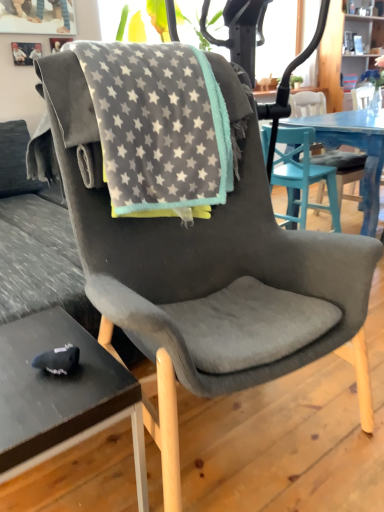
Question: From the image's perspective, is gray fleece blanket at center under suede gray chair at center?

Choices:
 (A) yes
 (B) no

Answer: (B)

Question: Does gray fleece blanket at center contain suede gray chair at center?

Choices:
 (A) yes
 (B) no

Answer: (B)

Question: Is gray fleece blanket at center positioned in front of suede gray chair at center?

Choices:
 (A) no
 (B) yes

Answer: (B)

Question: Can you confirm if gray fleece blanket at center is taller than suede gray chair at center?

Choices:
 (A) yes
 (B) no

Answer: (B)

Question: Can you confirm if gray fleece blanket at center is wider than suede gray chair at center?

Choices:
 (A) no
 (B) yes

Answer: (B)

Question: Looking at their shapes, would you say gray fleece blanket at center is wider or thinner than suede gray chair at center?

Choices:
 (A) thin
 (B) wide

Answer: (B)

Question: From the image's perspective, is gray fleece blanket at center located above or below suede gray chair at center?

Choices:
 (A) below
 (B) above

Answer: (B)

Question: Based on their sizes in the image, would you say gray fleece blanket at center is bigger or smaller than suede gray chair at center?

Choices:
 (A) big
 (B) small

Answer: (B)

Question: Is gray fleece blanket at center taller or shorter than suede gray chair at center?

Choices:
 (A) short
 (B) tall

Answer: (A)

Question: From a real-world perspective, is black matte desk at lower left physically located above or below gray fleece blanket at center?

Choices:
 (A) above
 (B) below

Answer: (B)

Question: Considering the positions of black matte desk at lower left and gray fleece blanket at center in the image, is black matte desk at lower left taller or shorter than gray fleece blanket at center?

Choices:
 (A) short
 (B) tall

Answer: (A)

Question: Considering the positions of black matte desk at lower left and gray fleece blanket at center in the image, is black matte desk at lower left bigger or smaller than gray fleece blanket at center?

Choices:
 (A) big
 (B) small

Answer: (B)

Question: In terms of width, does black matte desk at lower left look wider or thinner when compared to gray fleece blanket at center?

Choices:
 (A) thin
 (B) wide

Answer: (A)

Question: Considering the positions of point (211, 159) and point (54, 430), is point (211, 159) closer or farther from the camera than point (54, 430)?

Choices:
 (A) farther
 (B) closer

Answer: (A)

Question: From a real-world perspective, is gray fleece blanket at center positioned above or below black matte desk at lower left?

Choices:
 (A) below
 (B) above

Answer: (B)